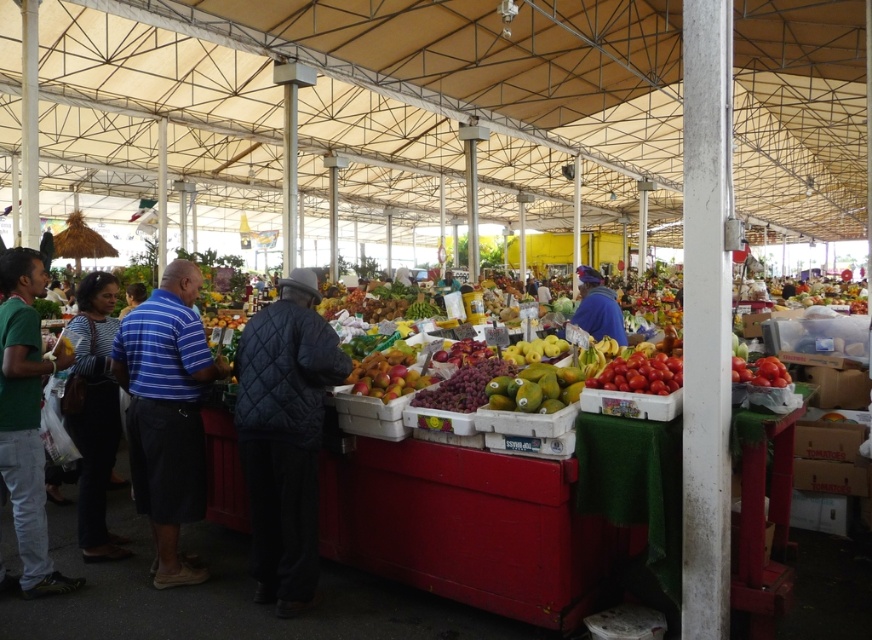
Which is behind, point (104, 432) or point (537, 392)?

The point (104, 432) is behind.

Can you confirm if striped fabric shirt at center is positioned below yellow matte mangoes at center?

Yes, striped fabric shirt at center is below yellow matte mangoes at center.

Who is more distant from viewer, (x=80, y=438) or (x=546, y=392)?

Positioned behind is point (x=80, y=438).

Locate an element on the screen. This screenshot has height=640, width=872. striped fabric shirt at center is located at coordinates (94, 413).

Can you confirm if shiny red tomatoes at right is positioned above blue quilted jacket at center?

No.

Does point (649, 380) lie in front of point (588, 284)?

Yes, point (649, 380) is closer to viewer.

This screenshot has width=872, height=640. What do you see at coordinates (639, 374) in the screenshot?
I see `shiny red tomatoes at right` at bounding box center [639, 374].

Identify the location of shiny red tomatoes at right. (639, 374).

Who is positioned more to the left, blue striped shirt at center or red matte tomatoes at right?

blue striped shirt at center is more to the left.

Between point (209, 356) and point (738, 358), which one is positioned in front?

Point (738, 358) is in front.

Identify the location of blue striped shirt at center. This screenshot has width=872, height=640. (167, 412).